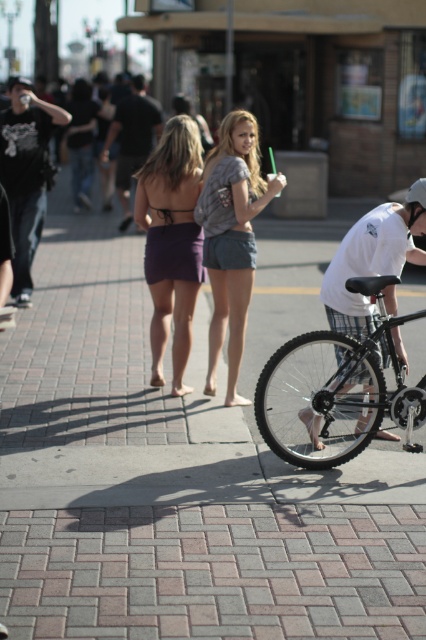
Which is more to the left, shiny black bike at lower right or matte black t-shirt at left?

matte black t-shirt at left is more to the left.

Does shiny black bike at lower right lie behind matte black t-shirt at left?

No, it is not.

Describe the element at coordinates (336, 388) in the screenshot. This screenshot has height=640, width=426. I see `shiny black bike at lower right` at that location.

Identify the location of shiny black bike at lower right. The image size is (426, 640). (336, 388).

Which is in front, point (28, 260) or point (425, 182)?

Point (425, 182)

Image resolution: width=426 pixels, height=640 pixels. What do you see at coordinates (26, 173) in the screenshot?
I see `matte black t-shirt at left` at bounding box center [26, 173].

Locate an element on the screen. The height and width of the screenshot is (640, 426). matte black t-shirt at left is located at coordinates (26, 173).

Which is below, white cotton shirt at center or dark gray t-shirt at center?

Positioned lower is white cotton shirt at center.

Which is above, white cotton shirt at center or dark gray t-shirt at center?

dark gray t-shirt at center is higher up.

Describe the element at coordinates (368, 264) in the screenshot. I see `white cotton shirt at center` at that location.

This screenshot has height=640, width=426. Find the location of `white cotton shirt at center`. white cotton shirt at center is located at coordinates (368, 264).